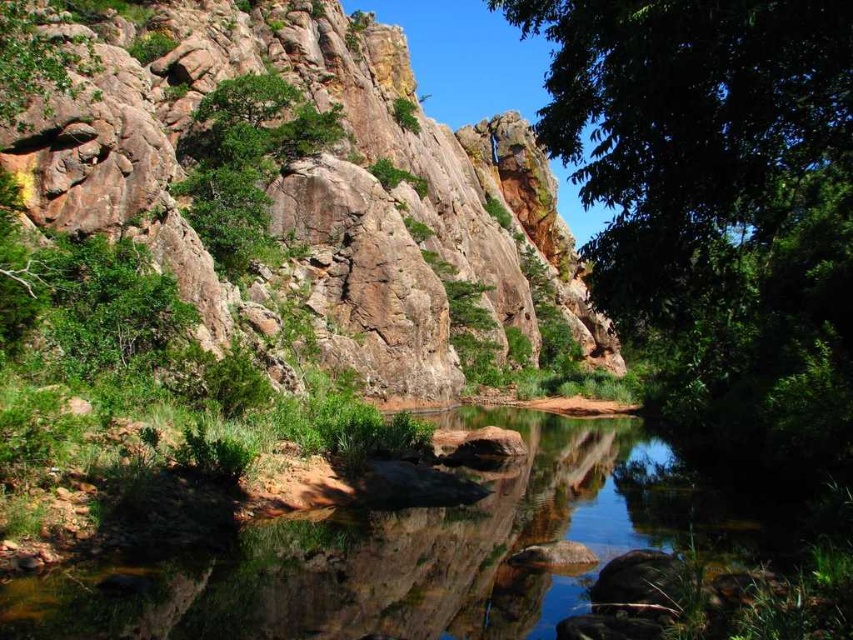
You are a hiker standing at the edge of the rustic stone hillside at upper center and want to cross to the clear water at center. Considering the height difference, is it feasible to jump directly from the hillside to the water?

The rustic stone hillside at upper center is much taller than the clear water at center, so jumping directly from the hillside to the water would not be feasible due to the significant height difference, posing a safety risk.

You are standing at the edge of the rustic stone hillside at upper center and want to cross to the clear water at center. Which direction should you move to reach it?

To reach the clear water at center from the rustic stone hillside at upper center, you should move to the left since the rustic stone hillside at upper center is positioned on the right side of the clear water at center.

Based on the photo, you are a hiker standing at the point indicated by point (306, 188) in the image. Based on the scene, what kind of terrain are you currently on?

The point (306, 188) indicates a rustic stone hillside at upper center, so you are on a rustic stone hillside.